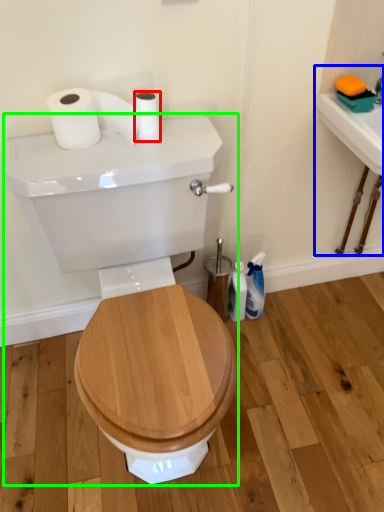
Question: Which is farther away from toilet paper (highlighted by a red box)? sink (highlighted by a blue box) or porcelain (highlighted by a green box)?

Choices:
 (A) sink
 (B) porcelain

Answer: (A)